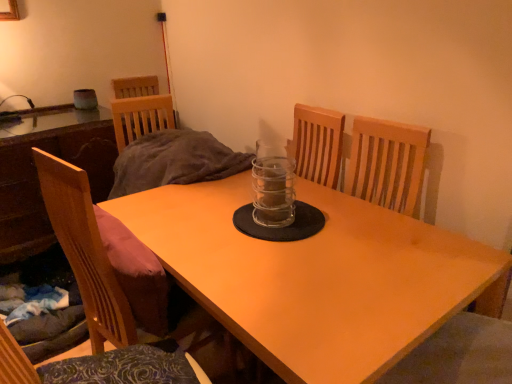
I want to click on blank space situated above light brown wooden table at center, the first table from the right (from a real-world perspective), so click(x=291, y=243).